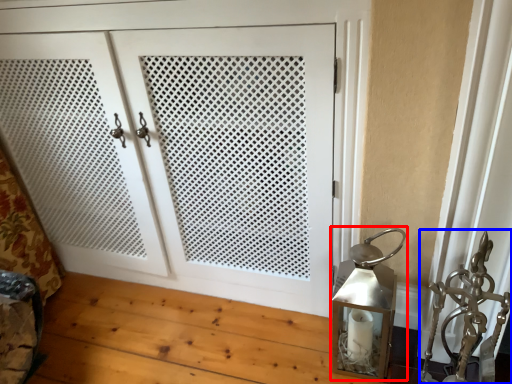
Question: Which object appears closest to the camera in this image, table lamp (highlighted by a red box) or sculpture (highlighted by a blue box)?

Choices:
 (A) table lamp
 (B) sculpture

Answer: (B)